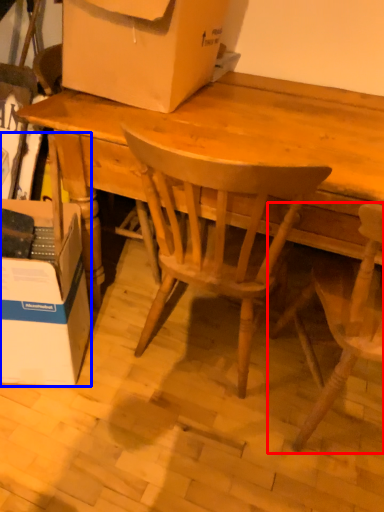
Question: Which of the following is the closest to the observer, chair (highlighted by a red box) or box (highlighted by a blue box)?

Choices:
 (A) chair
 (B) box

Answer: (A)